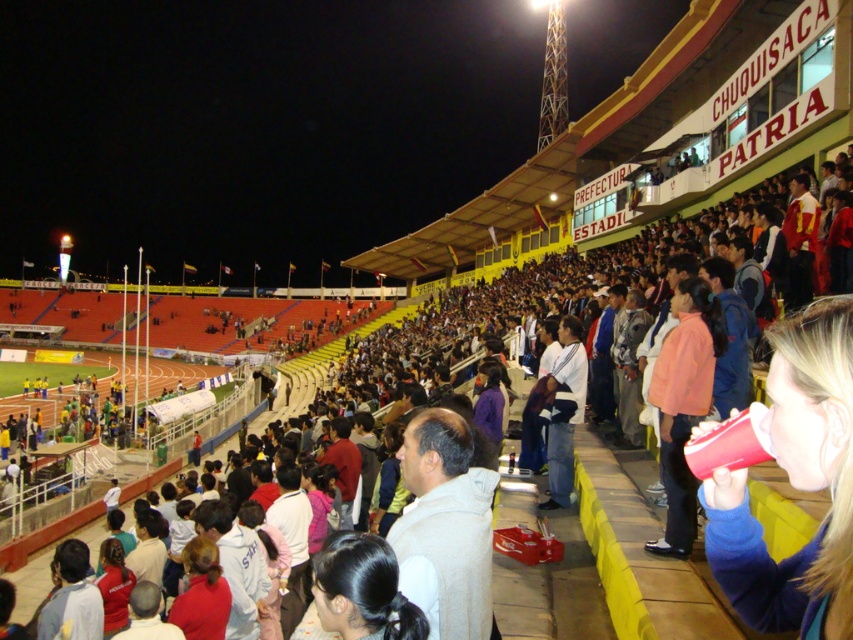
Question: Is matte red cup at lower right above white cotton shirt at center?

Choices:
 (A) yes
 (B) no

Answer: (B)

Question: Among these objects, which one is farthest from the camera?

Choices:
 (A) white cotton shirt at center
 (B) matte red cup at lower right

Answer: (A)

Question: Can you confirm if matte red cup at lower right is wider than white cotton shirt at center?

Choices:
 (A) yes
 (B) no

Answer: (B)

Question: Is matte red cup at lower right thinner than white cotton shirt at center?

Choices:
 (A) yes
 (B) no

Answer: (A)

Question: Among these points, which one is farthest from the camera?

Choices:
 (A) (744, 612)
 (B) (558, 401)

Answer: (B)

Question: Among these points, which one is nearest to the camera?

Choices:
 (A) (805, 356)
 (B) (573, 400)

Answer: (A)